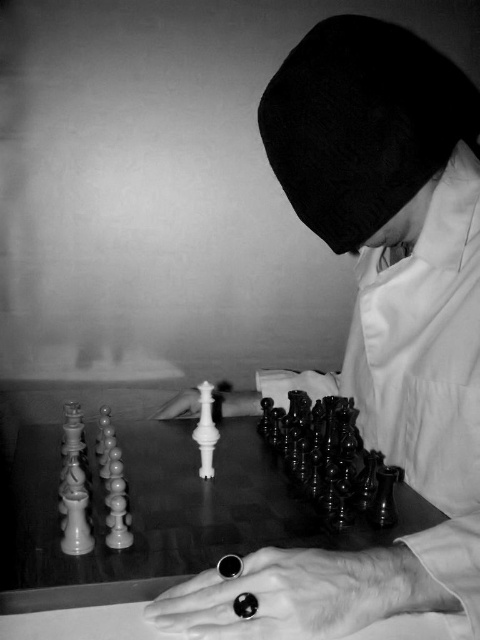
From the picture: You are a photographer trying to capture the chess pieces in this scene. Which object, the smooth black chess pieces at center or the black polished ring at lower center, would require you to adjust your camera focus to a higher setting due to its height?

The smooth black chess pieces at center are taller than the black polished ring at lower center, so you would need to adjust the camera focus to a higher setting for them.